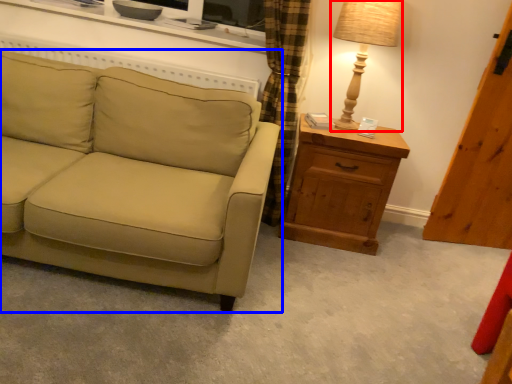
Question: Which object appears closest to the camera in this image, table lamp (highlighted by a red box) or studio couch (highlighted by a blue box)?

Choices:
 (A) table lamp
 (B) studio couch

Answer: (B)